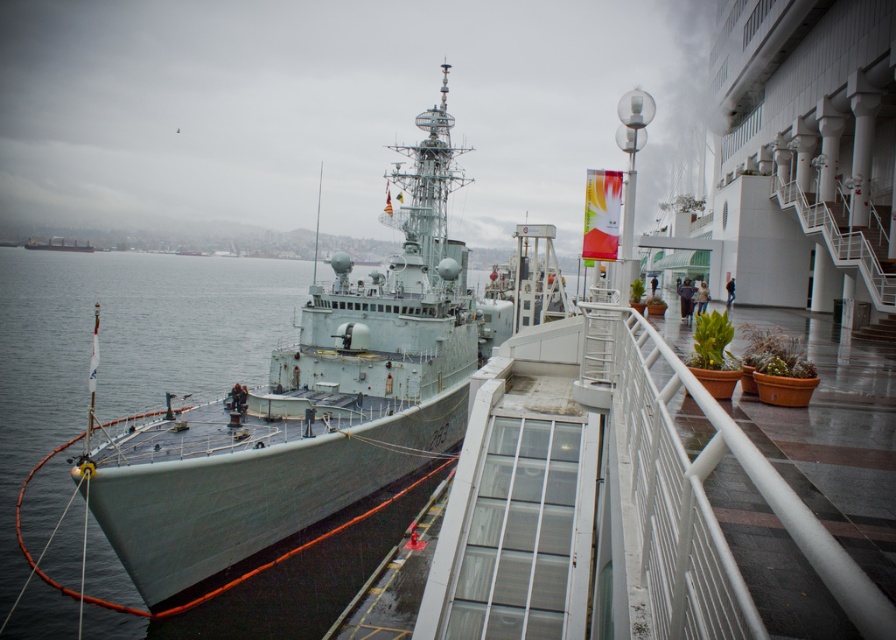
You are standing on the pier and want to take a photo of the gray metallic ship at center. Your camera has a maximum zoom range of 50 feet. Can you capture the entire ship in your photo without moving closer?

The gray metallic ship at center is 52.12 feet away from the camera. Since the camera can only zoom up to 50 feet, you cannot capture the entire ship without moving closer.

You are a dock worker who needs to secure the gray metallic ship at center to the pier. The gray metallic water at left is rising due to incoming tide. Which object will require more adjustments to accommodate the rising water level?

The gray metallic ship at center will require more adjustments because it is smaller than the gray metallic water at left, making it more affected by the rising water level.

You are standing on the pier and looking at the gray metallic ship at center and the gray metallic water at left. Which object appears shorter in height?

The gray metallic ship at center appears shorter in height than the gray metallic water at left because the description states that the gray metallic ship at center is not as tall as gray metallic water at left.